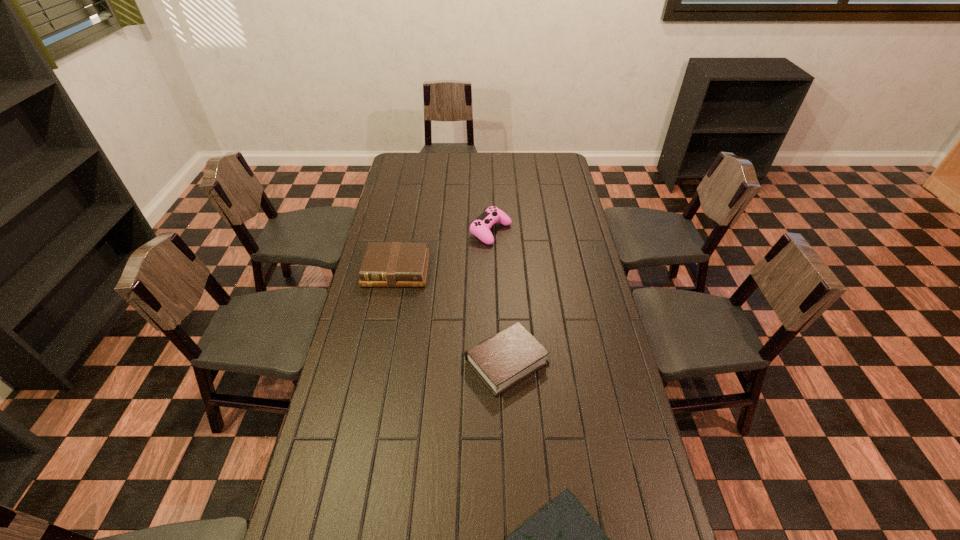
Image resolution: width=960 pixels, height=540 pixels. I want to click on free location that satisfies the following two spatial constraints: 1. on the front side of the control; 2. on the left side of the second nearest Bible, so click(494, 362).

Locate an element on the screen. Image resolution: width=960 pixels, height=540 pixels. free region that satisfies the following two spatial constraints: 1. on the spine side of the third farthest object; 2. on the right side of the leftmost Bible is located at coordinates (378, 362).

Identify the location of vacant space that satisfies the following two spatial constraints: 1. on the front side of the control; 2. on the right side of the second farthest Bible. (494, 362).

Identify the location of free space that satisfies the following two spatial constraints: 1. on the spine side of the farthest Bible; 2. on the left side of the third farthest object. (378, 362).